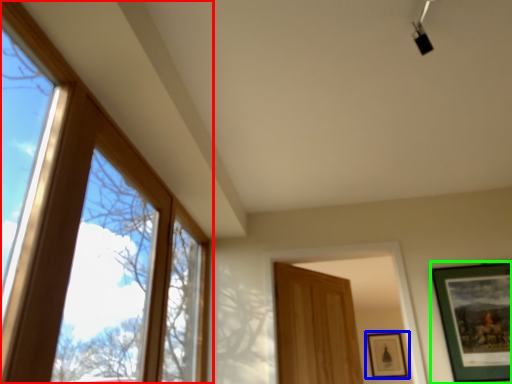
Question: Based on their relative distances, which object is farther from window (highlighted by a red box)? Choose from picture frame (highlighted by a blue box) and picture frame (highlighted by a green box).

Choices:
 (A) picture frame
 (B) picture frame

Answer: (A)